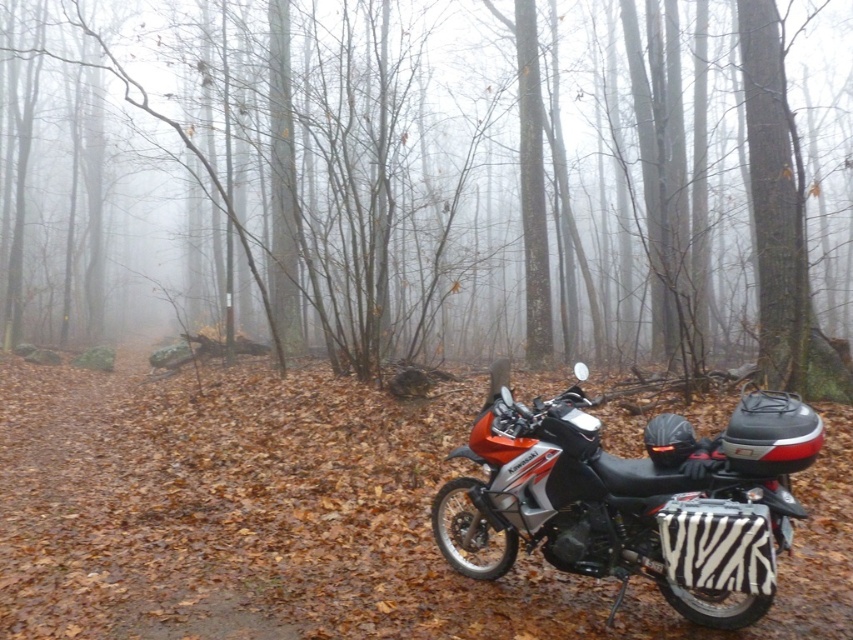
Measure the distance between brown matte tree at center and camera.

brown matte tree at center and camera are 6.46 meters apart.

How distant is brown matte tree at center from zebra-patterned side bag at lower right?

brown matte tree at center and zebra-patterned side bag at lower right are 19.58 meters apart.

Is point (329, 138) positioned before point (485, 536)?

No, (329, 138) is behind (485, 536).

Where is `brown matte tree at center`? The image size is (853, 640). brown matte tree at center is located at coordinates (436, 180).